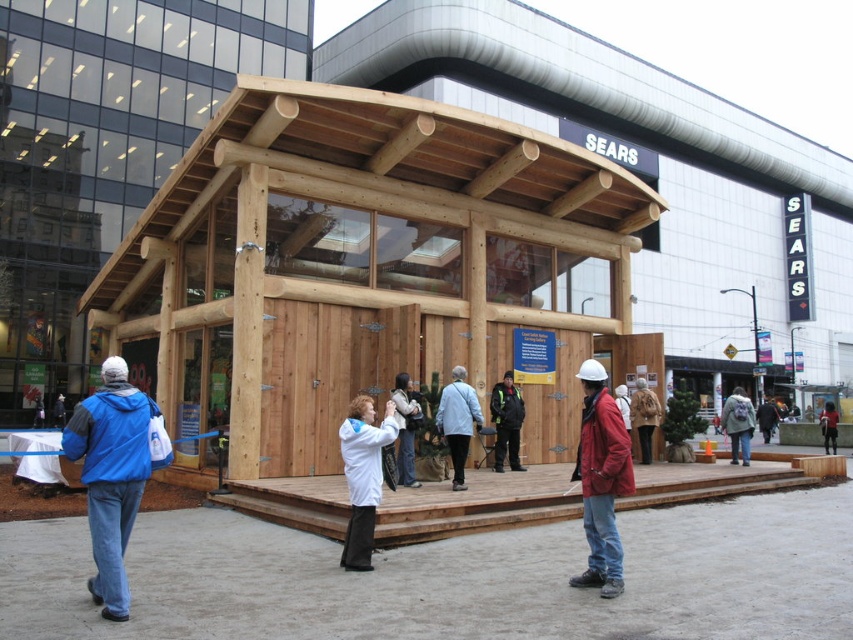
Is matte red jacket at center to the right of black leather jacket at center from the viewer's perspective?

Indeed, matte red jacket at center is positioned on the right side of black leather jacket at center.

Between matte red jacket at center and black leather jacket at center, which one is positioned lower?

Positioned lower is black leather jacket at center.

Is point (593, 408) positioned after point (514, 400)?

No, (593, 408) is closer to viewer.

This screenshot has width=853, height=640. I want to click on matte red jacket at center, so click(601, 481).

Is black leather jacket at center to the left of dark blue jacket at center from the viewer's perspective?

Yes, black leather jacket at center is to the left of dark blue jacket at center.

Is black leather jacket at center below dark blue jacket at center?

No.

The width and height of the screenshot is (853, 640). In order to click on black leather jacket at center in this screenshot , I will do `click(506, 420)`.

Identify the location of black leather jacket at center. click(x=506, y=420).

Who is more distant from viewer, (131,412) or (828,410)?

The point (828,410) is more distant.

Between blue fabric jacket at lower left and dark blue jacket at center, which one is positioned higher?

Positioned higher is blue fabric jacket at lower left.

Does point (140, 428) come in front of point (833, 440)?

Yes, point (140, 428) is in front of point (833, 440).

You are a GUI agent. You are given a task and a screenshot of the screen. Output one action in this format:
    pyautogui.click(x=<x>, y=<y>)
    Task: Click on the blue fabric jacket at lower left
    The height and width of the screenshot is (640, 853).
    Given the screenshot: What is the action you would take?
    pyautogui.click(x=111, y=474)